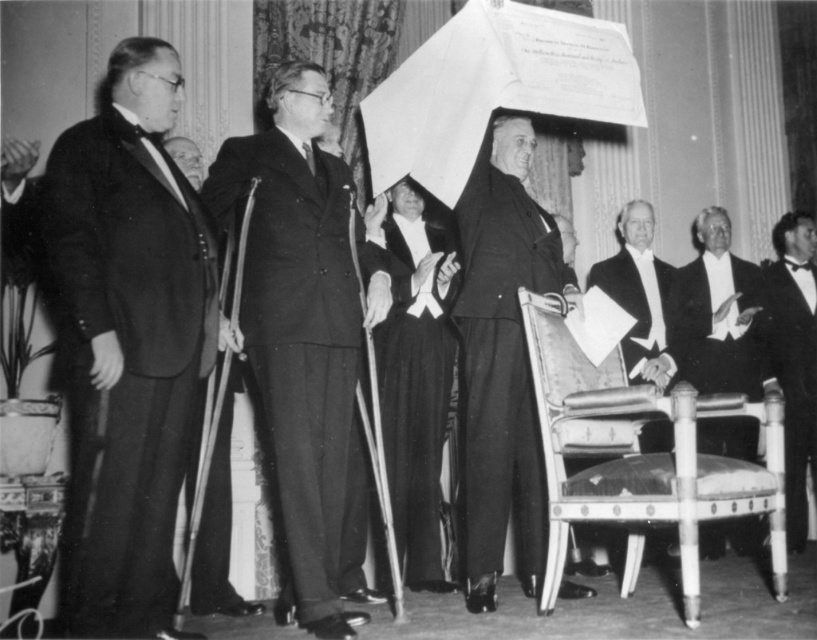
Looking at this image, based on the scene description, which object is positioned higher in the image between the smooth black suit at center and the silky black robe at center?

The smooth black suit at center is positioned higher than the silky black robe at center according to the description.

What is located at the point with coordinates (x=302, y=323) in the image?

The point at coordinates (x=302, y=323) is occupied by the smooth black suit at center.

In the scene, there is a leather upholstered chair at lower right and a silky black robe at center. Which object occupies more space in the image?

The leather upholstered chair at lower right has a larger size compared to the silky black robe at center, so it occupies more space in the image.